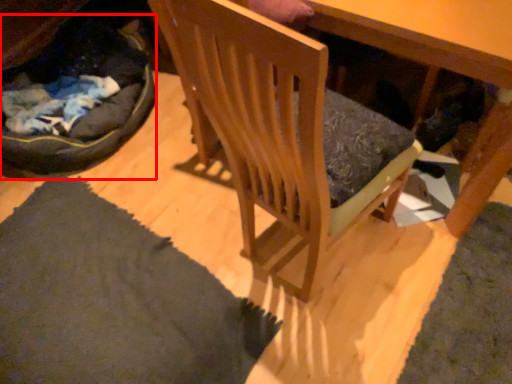
Question: From the image's perspective, where is cat bed (annotated by the red box) located in relation to chair in the image?

Choices:
 (A) above
 (B) below

Answer: (A)